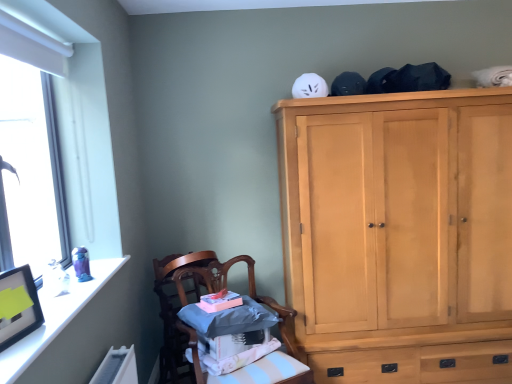
Question: Considering the relative sizes of wooden chair at lower left, acting as the second chair starting from the back, and light wood cabinet at upper right in the image provided, is wooden chair at lower left, acting as the second chair starting from the back, thinner than light wood cabinet at upper right?

Choices:
 (A) no
 (B) yes

Answer: (B)

Question: Is wooden chair at lower left, acting as the second chair starting from the back, oriented towards light wood cabinet at upper right?

Choices:
 (A) yes
 (B) no

Answer: (B)

Question: Considering the relative sizes of wooden chair at lower left, acting as the second chair starting from the back, and light wood cabinet at upper right in the image provided, is wooden chair at lower left, acting as the second chair starting from the back, taller than light wood cabinet at upper right?

Choices:
 (A) yes
 (B) no

Answer: (B)

Question: From a real-world perspective, does wooden chair at lower left, acting as the second chair starting from the back, stand above light wood cabinet at upper right?

Choices:
 (A) yes
 (B) no

Answer: (B)

Question: From the image's perspective, is wooden chair at lower left, acting as the second chair starting from the back, located above light wood cabinet at upper right?

Choices:
 (A) yes
 (B) no

Answer: (B)

Question: From a real-world perspective, is wooden chair at lower left, which appears as the 1th chair when viewed from the front, located beneath light wood cabinet at upper right?

Choices:
 (A) no
 (B) yes

Answer: (B)

Question: Does wooden chair at lower left, the first chair from the back, come in front of wooden chair at lower left, acting as the second chair starting from the back?

Choices:
 (A) yes
 (B) no

Answer: (B)

Question: Does wooden chair at lower left, arranged as the 2th chair when viewed from the front, appear on the right side of wooden chair at lower left, which appears as the 1th chair when viewed from the front?

Choices:
 (A) yes
 (B) no

Answer: (B)

Question: Is wooden chair at lower left, arranged as the 2th chair when viewed from the front, taller than wooden chair at lower left, acting as the second chair starting from the back?

Choices:
 (A) yes
 (B) no

Answer: (A)

Question: Is wooden chair at lower left, arranged as the 2th chair when viewed from the front, thinner than wooden chair at lower left, acting as the second chair starting from the back?

Choices:
 (A) yes
 (B) no

Answer: (A)

Question: Is wooden chair at lower left, the first chair from the back, smaller than wooden chair at lower left, which appears as the 1th chair when viewed from the front?

Choices:
 (A) yes
 (B) no

Answer: (A)

Question: Could you tell me if wooden chair at lower left, arranged as the 2th chair when viewed from the front, is turned towards wooden chair at lower left, acting as the second chair starting from the back?

Choices:
 (A) yes
 (B) no

Answer: (A)

Question: From the image's perspective, does wooden chair at lower left, the first chair from the back, appear higher than white glossy frame at upper left?

Choices:
 (A) yes
 (B) no

Answer: (B)